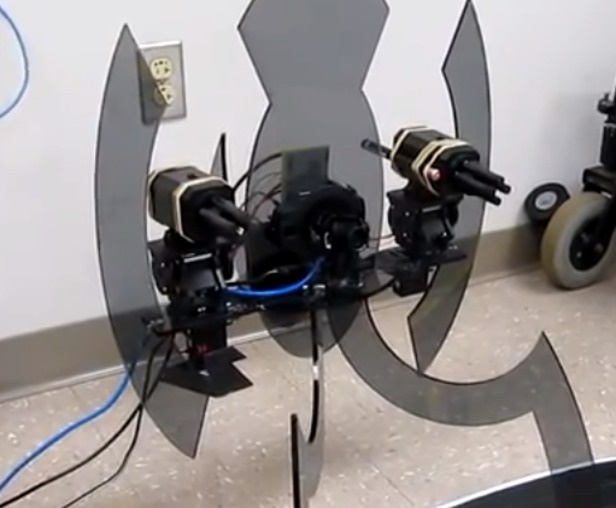
This screenshot has width=616, height=508. In order to click on empty space on wall above the power outlets in this screenshot , I will do `click(156, 35)`.